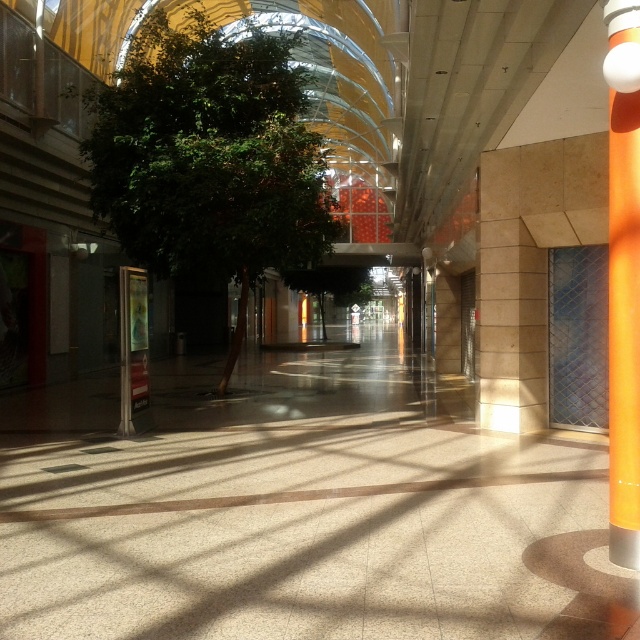
You are standing in the shopping arcade and see two points marked in the image. Which point is closer to you, point [193,42] or point [616,465]?

Point [193,42] is closer to you because it is further to the viewer than point [616,465].

You are a visitor in the mall and want to take a photo of the green leafy tree at center and the orange glossy pole at right. Which object should you focus on first if you want to capture both in a single frame without moving the camera?

The green leafy tree at center has a smaller size compared to orange glossy pole at right, so you should focus on the orange glossy pole at right first since it is larger and will be more prominent in the frame.

You are a visitor in the mall and want to take a photo of both the green leafy tree at center and the orange glossy pole at right. Which object should you focus on first if you want to capture both in one frame without moving your camera?

Since the green leafy tree at center is shorter than the orange glossy pole at right, you should focus on the orange glossy pole at right first as it is taller and might require adjusting the camera angle to include its full height while still framing the shorter tree in the center.